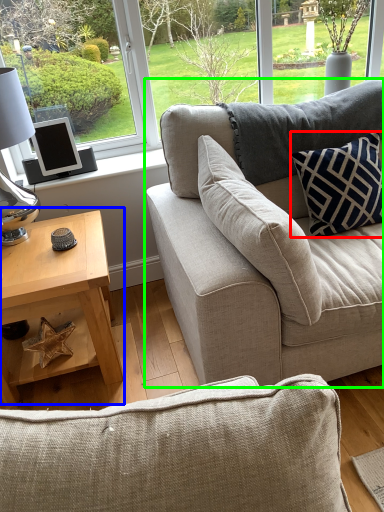
Question: Which object is the farthest from pillow (highlighted by a red box)? Choose among these: coffee table (highlighted by a blue box) or studio couch (highlighted by a green box).

Choices:
 (A) coffee table
 (B) studio couch

Answer: (A)